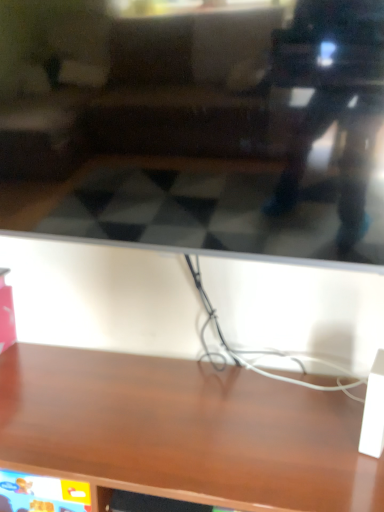
Locate an element on the screen. This screenshot has width=384, height=512. blank space situated above brown wooden table at center (from a real-world perspective) is located at coordinates (171, 408).